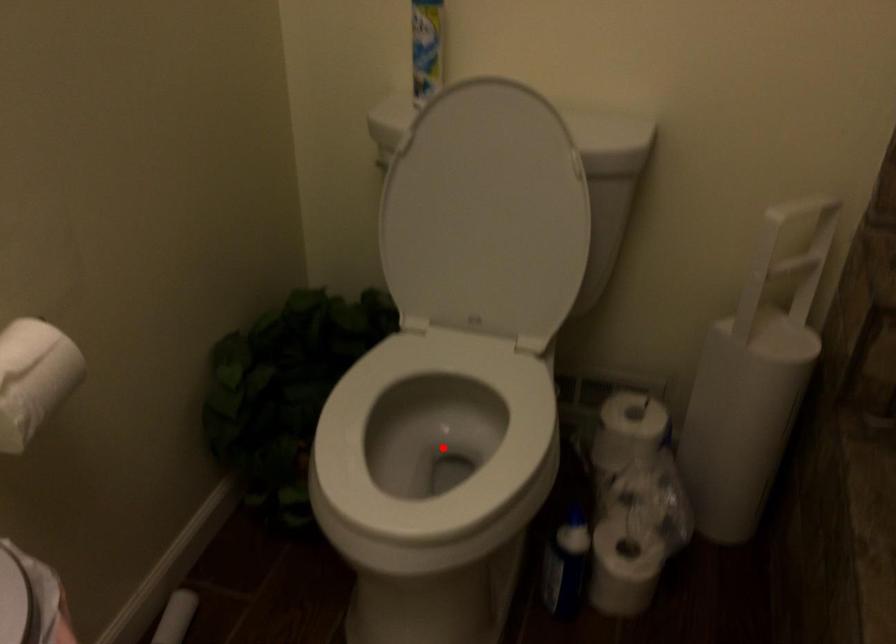
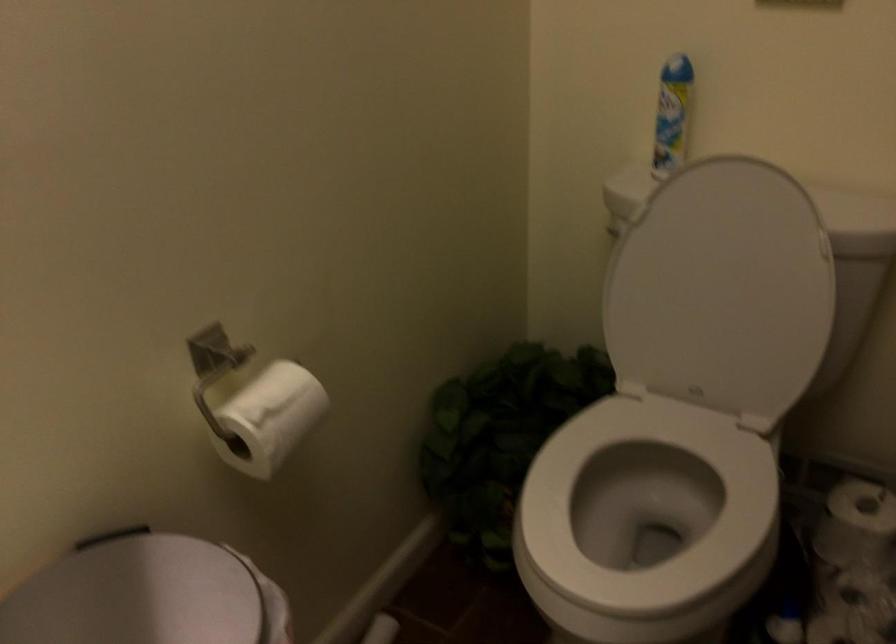
Locate, in the second image, the point that corresponds to the highlighted location in the first image.

(645, 516)